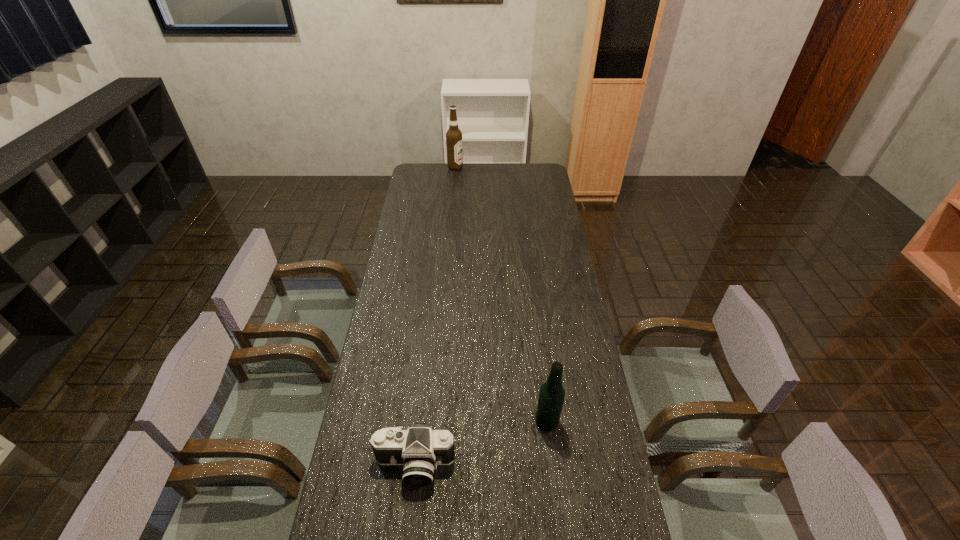
Identify the location of the taller alcohol. Image resolution: width=960 pixels, height=540 pixels. (453, 136).

The width and height of the screenshot is (960, 540). I want to click on the farthest object, so click(453, 136).

Where is `the second nearest object`? The width and height of the screenshot is (960, 540). the second nearest object is located at coordinates (551, 397).

Image resolution: width=960 pixels, height=540 pixels. I want to click on the rightmost object, so click(551, 397).

This screenshot has width=960, height=540. What are the coordinates of `camera` in the screenshot? It's located at (420, 449).

I want to click on the shortest object, so click(x=420, y=449).

Where is `vacant space located on the label of the farther alcohol`? The image size is (960, 540). vacant space located on the label of the farther alcohol is located at coordinates (483, 167).

The width and height of the screenshot is (960, 540). Identify the location of vacant region located on the front of the shorter alcohol. (551, 456).

Locate an element on the screen. free space located on the back of the shortest object is located at coordinates (422, 392).

At what (x,y) coordinates should I click in order to perform the action: click on object that is at the far edge. Please return your answer as a coordinate pair (x, y). Looking at the image, I should click on (453, 136).